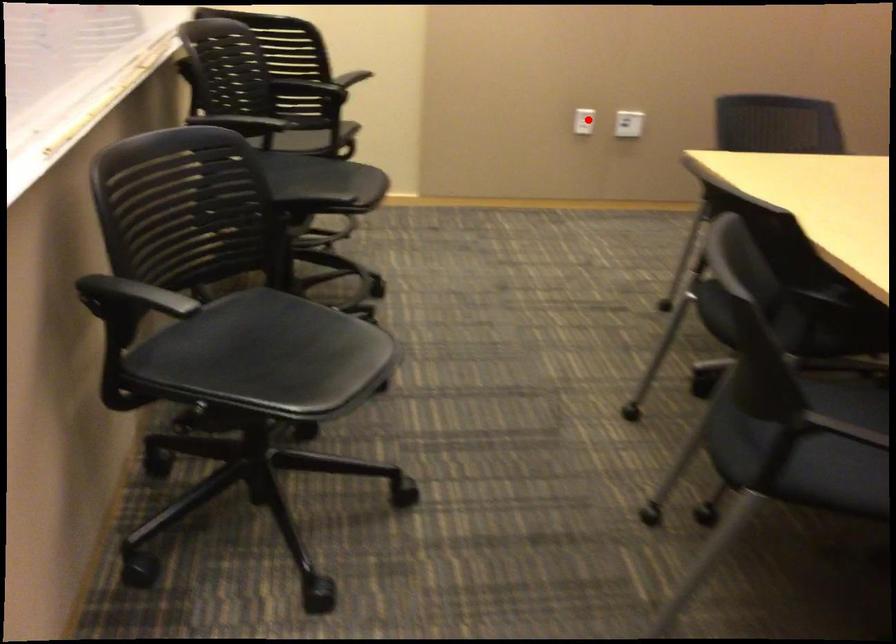
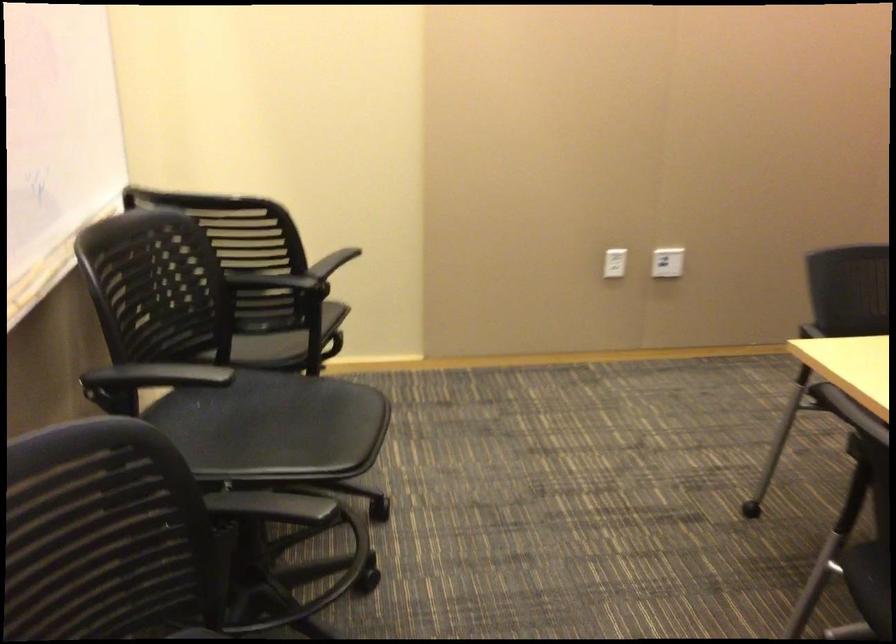
Question: I am providing you with two images of the same scene from different viewpoints. A red point is marked on the first image. Is the red point's position out of view in image 2?

Choices:
 (A) Yes
 (B) No

Answer: (B)